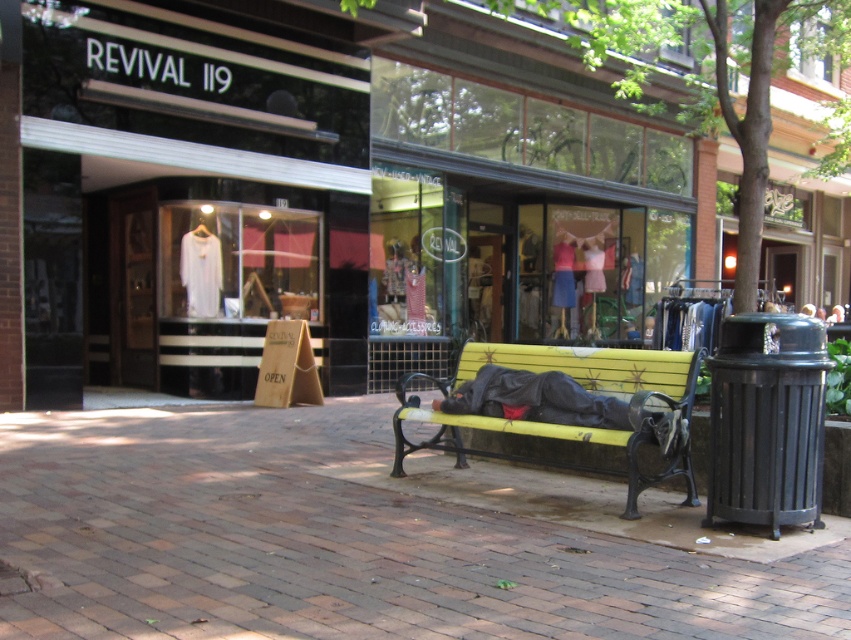
You are standing in front of the store with the bench. There are two points marked on the scene. Which point is closer to you, point (427, 474) or point (635, 371)?

Point (427, 474) is closer to you because it is further to the viewer than point (635, 371).

You are a delivery person who needs to place a package on the brick pavement at center. However, there is a yellow painted wood bench at center in the way. Can you move the bench to access the pavement?

The brick pavement at center is in front of the yellow painted wood bench at center, meaning the bench is between you and the pavement. Since benches are typically stationary, you cannot move it to access the pavement.

You are a delivery person trying to place a heavy box on the ground near the yellow painted wood bench at center. Where should you place the box so it doesn not get in the way of pedestrians walking on the brick pavement at center?

The brick pavement at center is positioned under yellow painted wood bench at center, so placing the box on the brick pavement at center would place it directly under the bench, keeping it out of the pedestrians path.